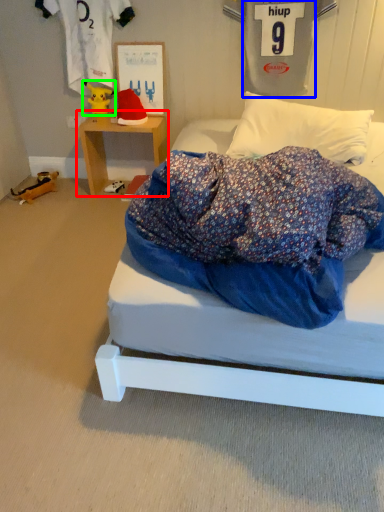
Question: Which is nearer to the table (highlighted by a red box)? clothing (highlighted by a blue box) or toy (highlighted by a green box).

Choices:
 (A) clothing
 (B) toy

Answer: (B)